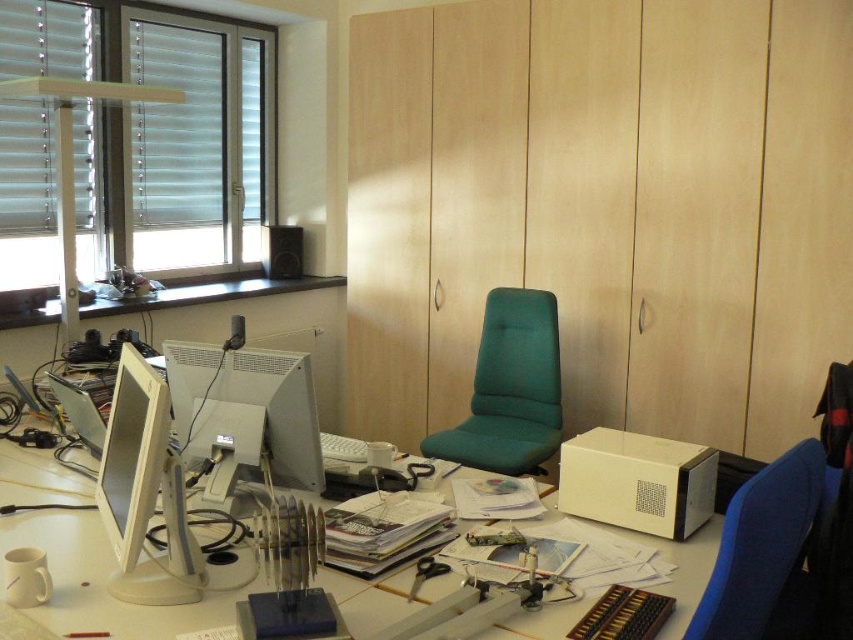
Is white blinds at upper left shorter than matte white monitor at left?

No.

Between white blinds at upper left and matte white monitor at left, which one appears on the left side from the viewer's perspective?

white blinds at upper left

Does point (148, 220) come farther from viewer compared to point (115, 456)?

That is True.

This screenshot has height=640, width=853. In order to click on white blinds at upper left in this screenshot , I will do `click(198, 141)`.

Who is positioned more to the right, white plastic table at center or matte white monitor at left?

From the viewer's perspective, white plastic table at center appears more on the right side.

Who is more forward, (230, 566) or (146, 364)?

Point (146, 364) is more forward.

Where is `white plastic table at center`? The image size is (853, 640). white plastic table at center is located at coordinates [x=97, y=582].

Identify the location of white plastic table at center. (97, 582).

Who is higher up, white plastic table at center or green fabric swivel chair at center?

green fabric swivel chair at center is higher up.

Who is more distant from viewer, [28,540] or [492,417]?

Positioned behind is point [492,417].

At what (x,y) coordinates should I click in order to perform the action: click on white plastic table at center. Please return your answer as a coordinate pair (x, y). This screenshot has height=640, width=853. Looking at the image, I should click on (97, 582).